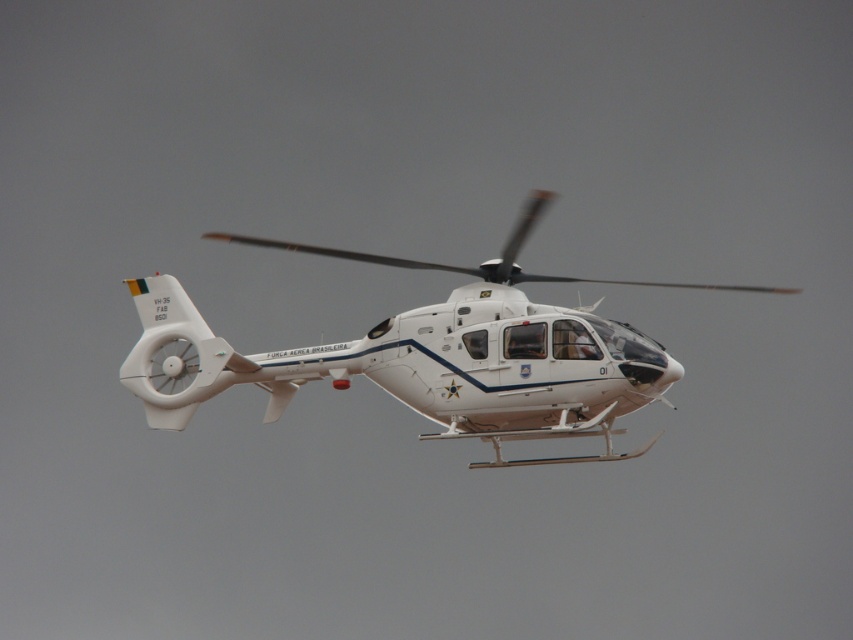
Question: Observing the image, what is the correct spatial positioning of white glossy helicopter at center in reference to white matte propeller at center?

Choices:
 (A) above
 (B) below

Answer: (B)

Question: Which point is farther to the camera?

Choices:
 (A) (401, 352)
 (B) (682, 284)

Answer: (B)

Question: In this image, where is white glossy helicopter at center located relative to white matte propeller at center?

Choices:
 (A) right
 (B) left

Answer: (B)

Question: Can you confirm if white glossy helicopter at center is positioned to the left of white matte propeller at center?

Choices:
 (A) yes
 (B) no

Answer: (A)